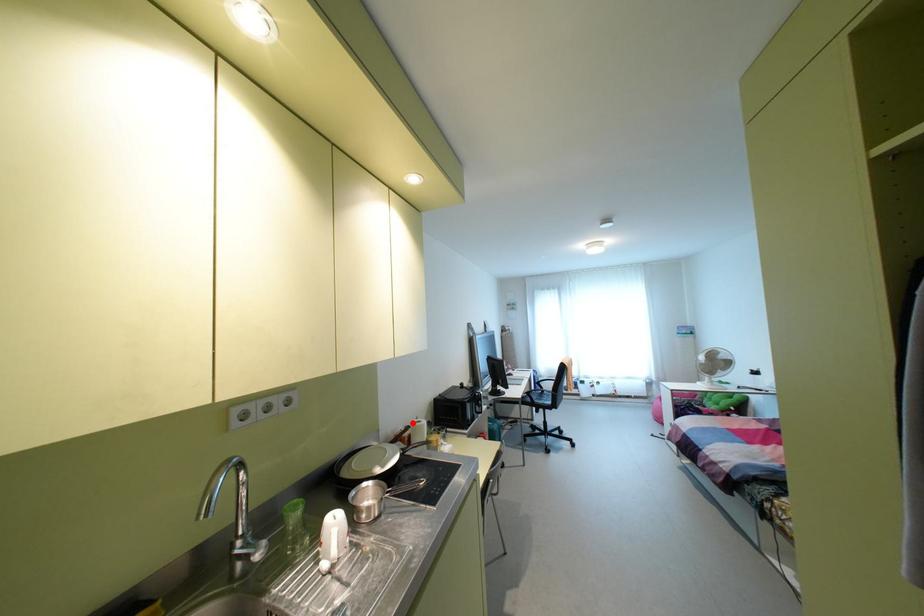
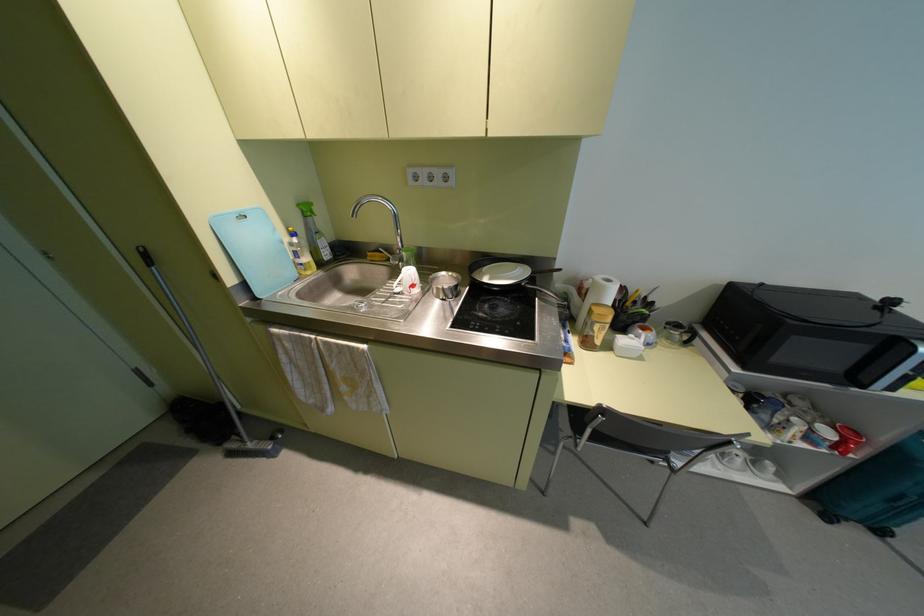
The point at the highlighted location is marked in the first image. Where is the corresponding point in the second image?

(599, 277)